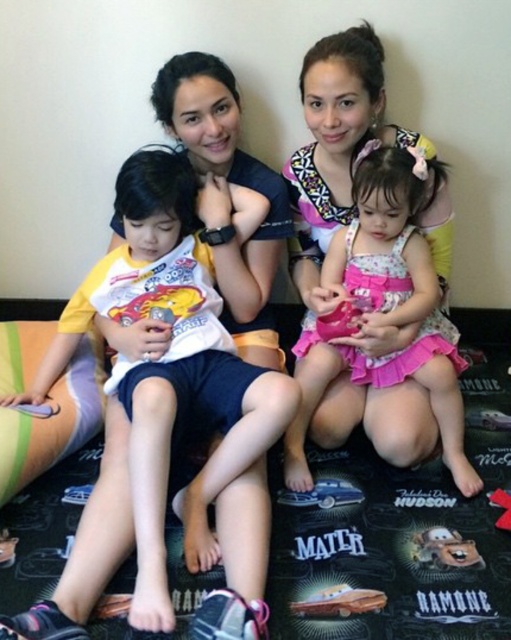
Who is more forward, (308, 611) or (499, 500)?

Point (308, 611) is in front.

Between point (358, 611) and point (493, 493), which one is positioned in front?

Point (358, 611) is more forward.

This screenshot has width=511, height=640. I want to click on metallic gold car at lower center, so click(339, 602).

Between metallic blue car at lower center and rubber red toy at lower right, which one is positioned lower?

rubber red toy at lower right is below.

Does metallic blue car at lower center appear over rubber red toy at lower right?

Yes.

Image resolution: width=511 pixels, height=640 pixels. Identify the location of metallic blue car at lower center. click(322, 493).

Where is `metallic blue car at lower center`? The image size is (511, 640). metallic blue car at lower center is located at coordinates (322, 493).

Which is below, white cotton shirt at center or brown plush toy at lower right?

brown plush toy at lower right is below.

Is white cotton shirt at center in front of brown plush toy at lower right?

Yes, white cotton shirt at center is closer to the viewer.

This screenshot has height=640, width=511. Describe the element at coordinates (166, 396) in the screenshot. I see `white cotton shirt at center` at that location.

Where is `white cotton shirt at center`? The width and height of the screenshot is (511, 640). white cotton shirt at center is located at coordinates (166, 396).